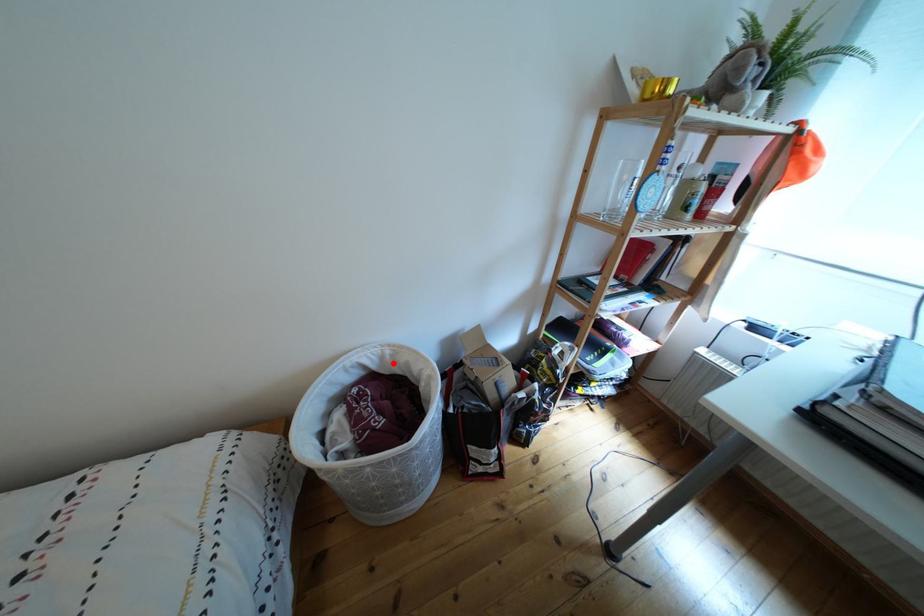
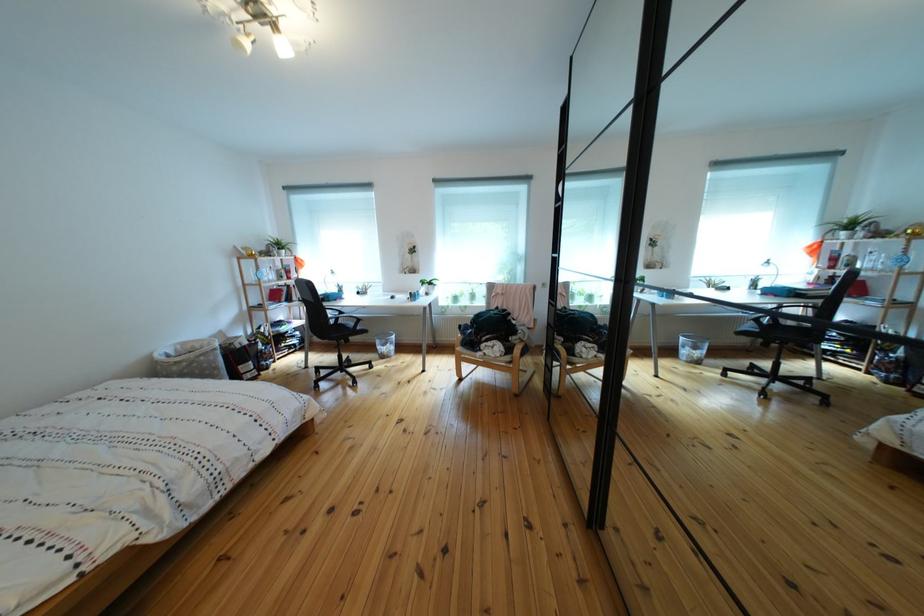
Locate, in the second image, the point that corresponds to the highlighted location in the first image.

(187, 355)